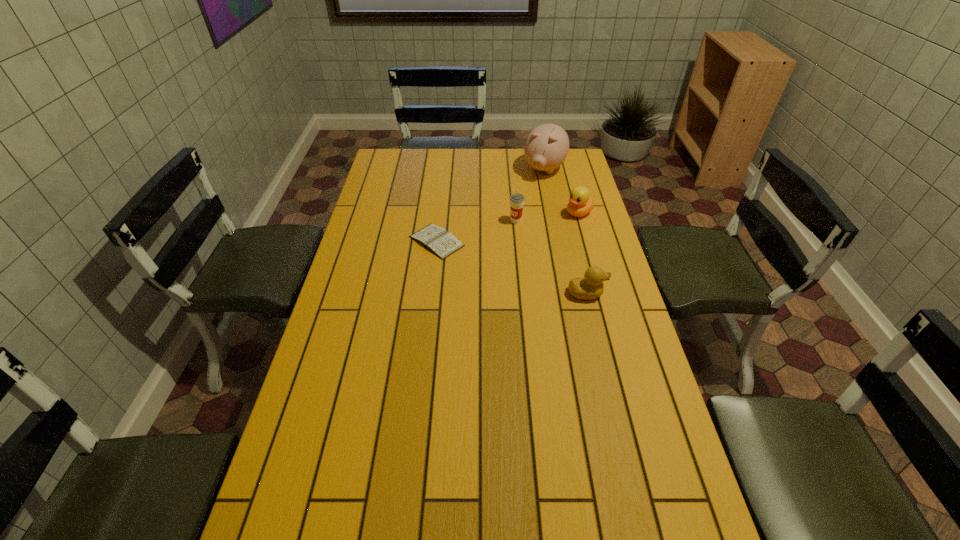
The width and height of the screenshot is (960, 540). Find the location of `vacant space that satisfies the following two spatial constraints: 1. on the back side of the farther duckling; 2. on the right side of the diary`. vacant space that satisfies the following two spatial constraints: 1. on the back side of the farther duckling; 2. on the right side of the diary is located at coordinates (440, 213).